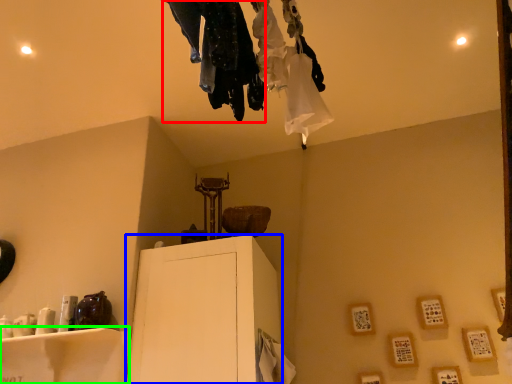
Question: Which object is positioned closest to clothing (highlighted by a red box)? Select from furniture (highlighted by a blue box) and furniture (highlighted by a green box).

Choices:
 (A) furniture
 (B) furniture

Answer: (A)